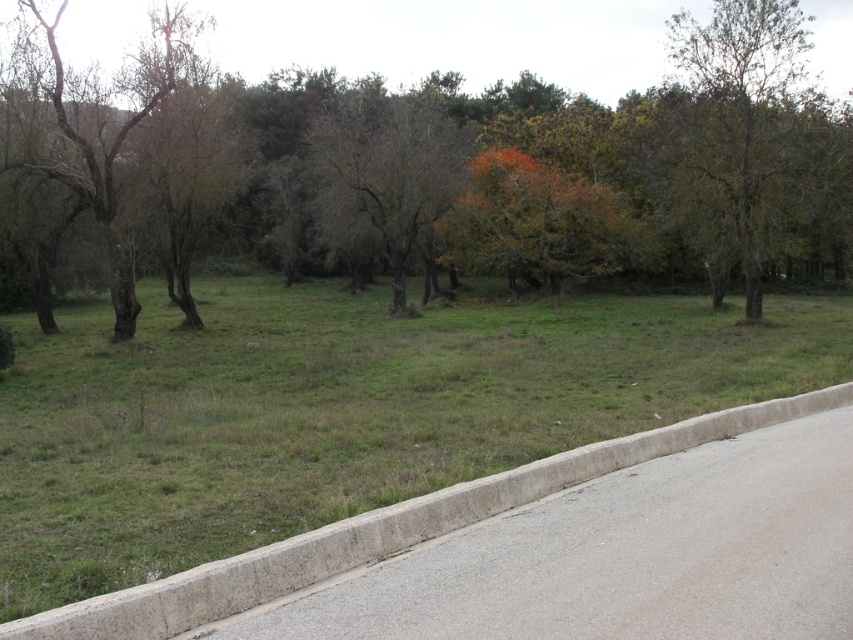
Is point (300, 84) farther from viewer compared to point (338, 115)?

Yes, it is.

From the picture: Who is more distant from viewer, (x=531, y=276) or (x=412, y=99)?

The point (x=412, y=99) is more distant.

Identify the location of brown matte tree at left. The height and width of the screenshot is (640, 853). (602, 161).

Is green grass at center to the right of bare branches at left from the viewer's perspective?

Indeed, green grass at center is positioned on the right side of bare branches at left.

This screenshot has width=853, height=640. In order to click on green grass at center in this screenshot , I will do `click(340, 410)`.

This screenshot has height=640, width=853. What do you see at coordinates (602, 161) in the screenshot?
I see `brown matte tree at left` at bounding box center [602, 161].

Does brown matte tree at left have a greater height compared to bare branches at left?

Correct, brown matte tree at left is much taller as bare branches at left.

Does point (830, 212) lie in front of point (102, 212)?

No, (830, 212) is further to viewer.

Identify the location of brown matte tree at left. This screenshot has width=853, height=640. (602, 161).